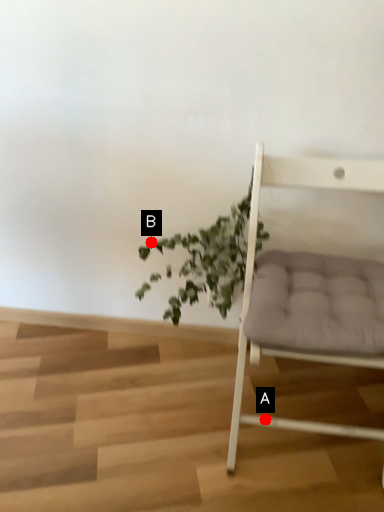
Question: Two points are circled on the image, labeled by A and B beside each circle. Which point appears closest to the camera in this image?

Choices:
 (A) A is closer
 (B) B is closer

Answer: (A)